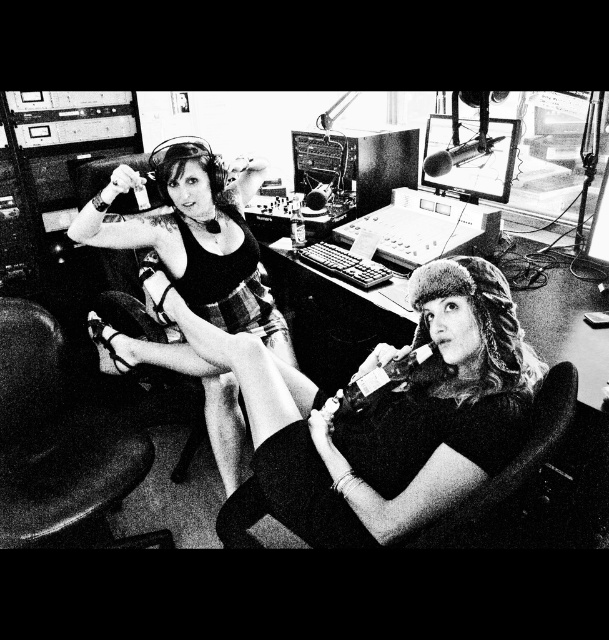
Question: Which of the following is the closest to the observer?

Choices:
 (A) soft fur hat at center
 (B) matte black dress at left
 (C) metallic keyboard at center
 (D) metallic silver microphone at upper center

Answer: (A)

Question: Among these objects, which one is nearest to the camera?

Choices:
 (A) matte black dress at left
 (B) leather swivel chair at lower left
 (C) soft fur hat at center
 (D) metallic keyboard at center

Answer: (C)

Question: Is leather swivel chair at lower left wider than soft fabric chair at lower right?

Choices:
 (A) no
 (B) yes

Answer: (B)

Question: Does soft fur hat at center have a smaller size compared to metallic keyboard at center?

Choices:
 (A) no
 (B) yes

Answer: (A)

Question: Can you confirm if soft fur hat at center is positioned above metallic keyboard at center?

Choices:
 (A) no
 (B) yes

Answer: (A)

Question: Estimate the real-world distances between objects in this image. Which object is farther from the matte black dress at left?

Choices:
 (A) metallic silver microphone at upper center
 (B) metallic keyboard at center
 (C) leather swivel chair at lower left

Answer: (A)